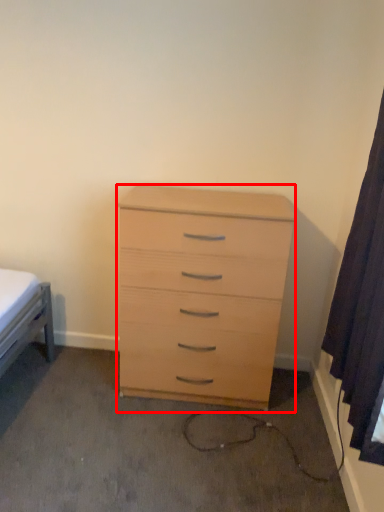
Question: Considering the relative positions of chest of drawers (annotated by the red box) and curtain in the image provided, where is chest of drawers (annotated by the red box) located with respect to the staircase?

Choices:
 (A) right
 (B) left

Answer: (B)